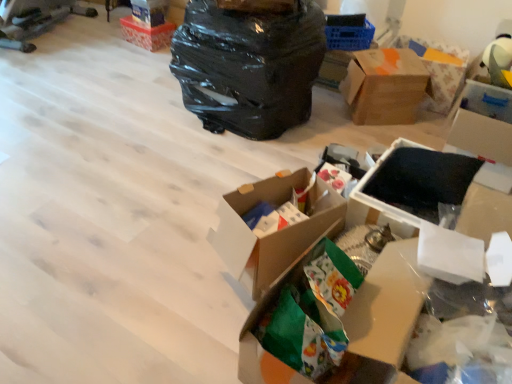
This screenshot has height=384, width=512. Identify the location of vacant region to the left of black plastic bag at upper center. (134, 102).